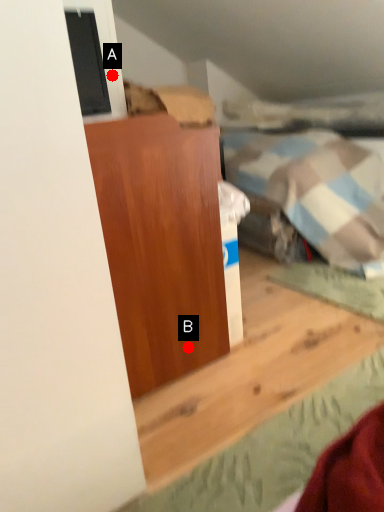
Question: Two points are circled on the image, labeled by A and B beside each circle. Which point appears closest to the camera in this image?

Choices:
 (A) A is closer
 (B) B is closer

Answer: (B)